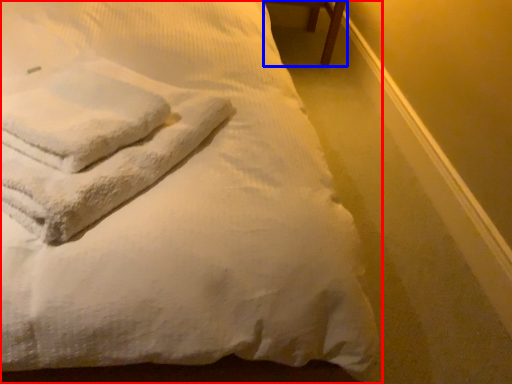
Question: Which of the following is the closest to the observer, bed (highlighted by a red box) or furniture (highlighted by a blue box)?

Choices:
 (A) bed
 (B) furniture

Answer: (A)